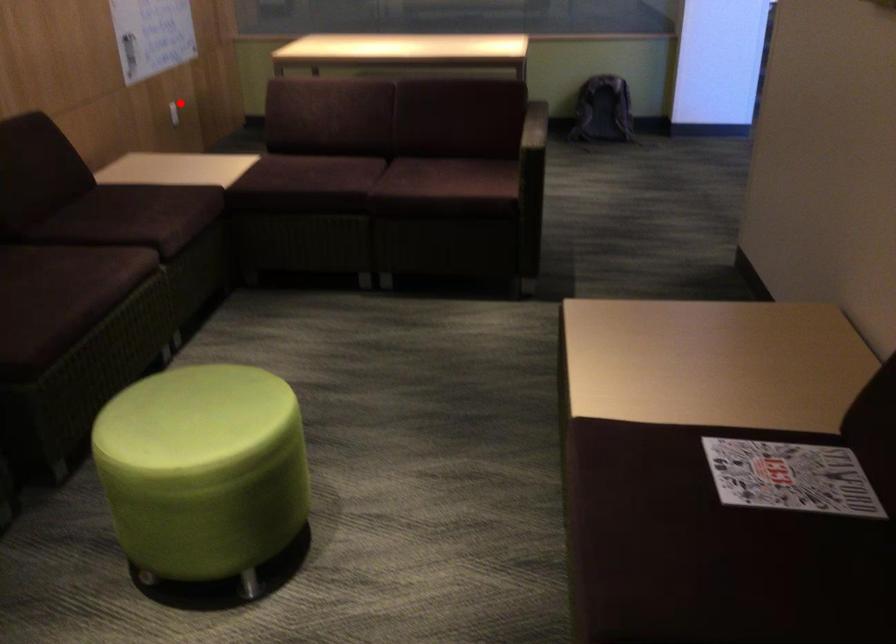
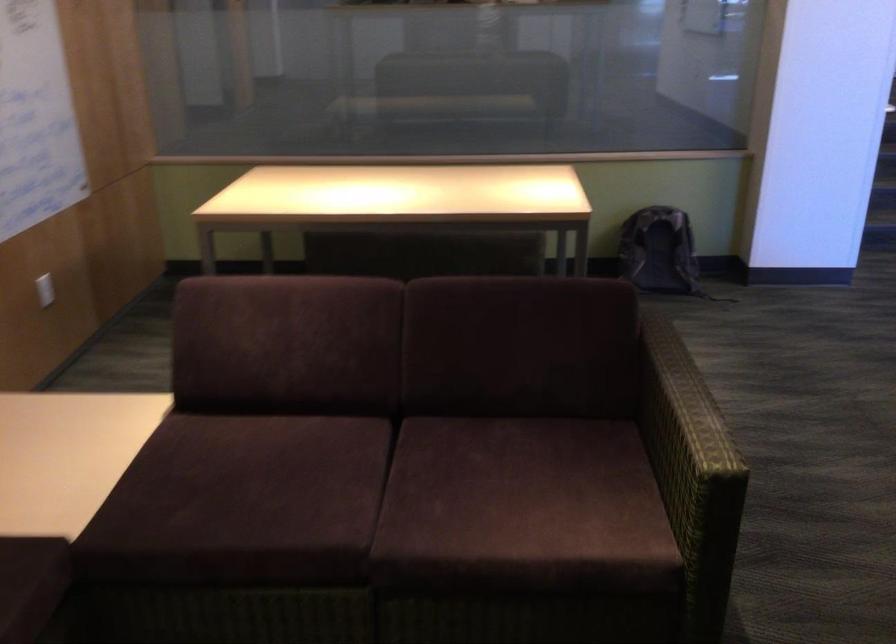
Find the pixel in the second image that matches the highlighted location in the first image.

(45, 289)